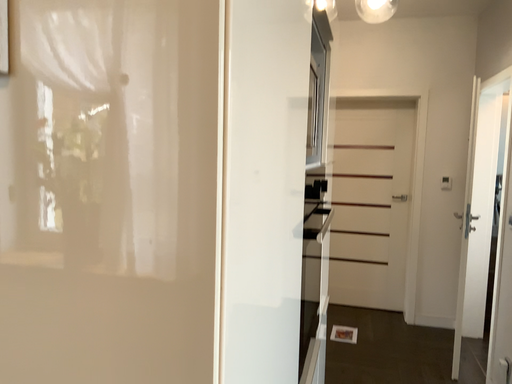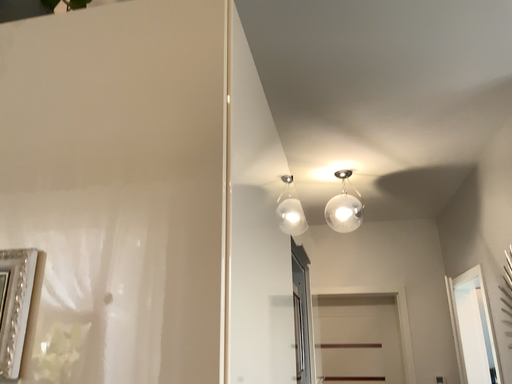
Question: How did the camera likely rotate when shooting the video?

Choices:
 (A) rotated upward
 (B) rotated downward

Answer: (A)